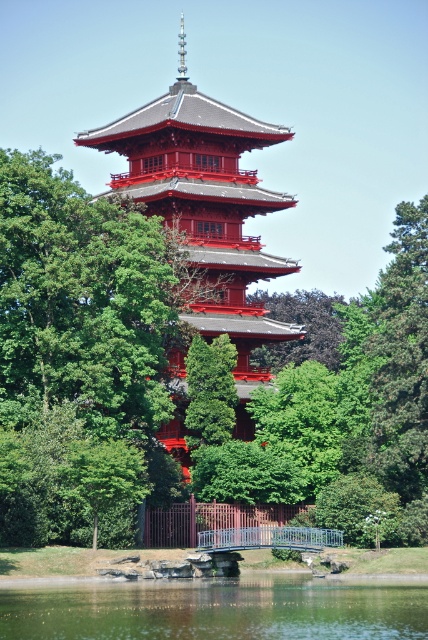
Which is above, shiny red pagoda at center or green reflective water at lower center?

shiny red pagoda at center is higher up.

Based on the photo, is shiny red pagoda at center thinner than green reflective water at lower center?

Yes, shiny red pagoda at center is thinner than green reflective water at lower center.

This screenshot has height=640, width=428. Describe the element at coordinates (205, 211) in the screenshot. I see `shiny red pagoda at center` at that location.

You are a GUI agent. You are given a task and a screenshot of the screen. Output one action in this format:
    pyautogui.click(x=<x>, y=<y>)
    Task: Click on the shiny red pagoda at center
    
    Given the screenshot: What is the action you would take?
    pyautogui.click(x=205, y=211)

Looking at this image, between green reflective water at lower center and green leafy tree at center, which one has more height?

green leafy tree at center

Does green reflective water at lower center have a greater height compared to green leafy tree at center?

No.

Is point (371, 630) less distant than point (306, 316)?

Yes, it is.

Locate an element on the screen. This screenshot has width=428, height=640. green reflective water at lower center is located at coordinates (219, 609).

Is the position of green reflective water at lower center less distant than that of green textured tree at center?

Yes, it is in front of green textured tree at center.

Can you confirm if green reflective water at lower center is shorter than green textured tree at center?

No, green reflective water at lower center is not shorter than green textured tree at center.

Is point (220, 628) positioned before point (204, 440)?

Yes.

I want to click on green reflective water at lower center, so click(219, 609).